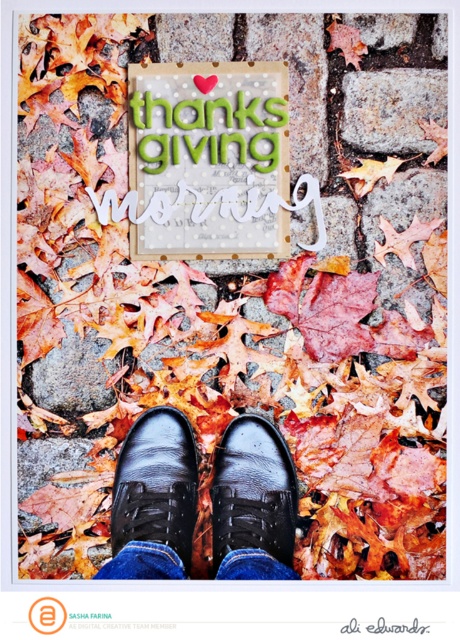
Is point (138, 68) farther from camera compared to point (282, 490)?

No, (138, 68) is closer to viewer.

Between point (190, 145) and point (235, 524), which one is positioned behind?

The point (190, 145) is more distant.

In order to click on matte cardboard sign at center in this screenshot , I will do `click(207, 156)`.

Who is lower down, black leather shoe at center or glossy leather shoe at center?

glossy leather shoe at center is below.

Looking at this image, is black leather shoe at center shorter than glossy leather shoe at center?

No.

Between point (138, 449) and point (247, 541), which one is positioned in front?

Point (247, 541)

Locate an element on the screen. black leather shoe at center is located at coordinates (155, 483).

Looking at this image, between black leather shoes at center and black leather shoe at center, which one has less height?

With less height is black leather shoe at center.

Can you confirm if black leather shoes at center is wider than black leather shoe at center?

Indeed, black leather shoes at center has a greater width compared to black leather shoe at center.

Identify the location of black leather shoes at center. coord(154,493).

You are a GUI agent. You are given a task and a screenshot of the screen. Output one action in this format:
    pyautogui.click(x=<x>, y=<y>)
    Task: Click on the black leather shoes at center
    
    Given the screenshot: What is the action you would take?
    (x=154, y=493)